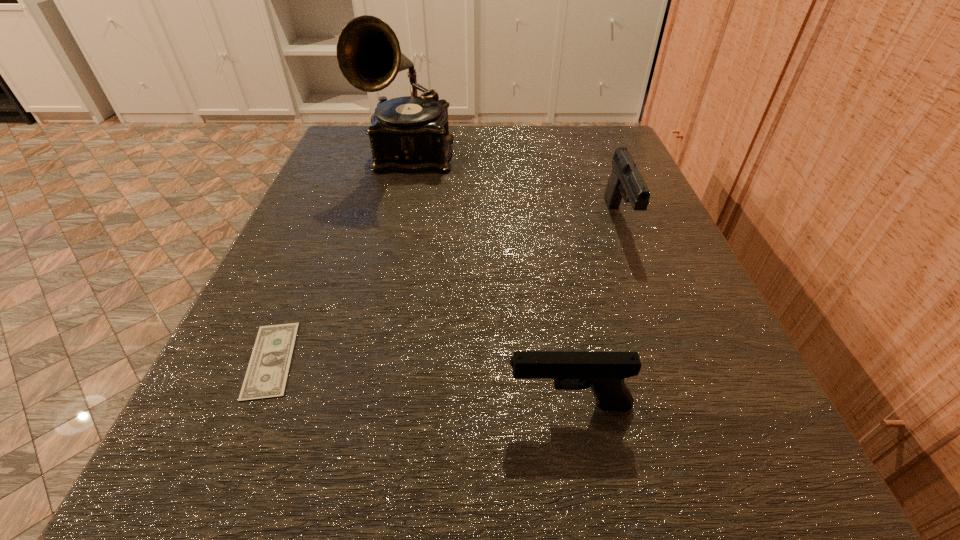
I want to click on phonograph record, so click(408, 134).

Locate an element on the screen. The image size is (960, 540). the tallest object is located at coordinates (408, 134).

The image size is (960, 540). Find the location of `the farther pistol`. the farther pistol is located at coordinates click(625, 180).

Identify the location of the rightmost object. (625, 180).

The height and width of the screenshot is (540, 960). What are the coordinates of `the nearer pistol` in the screenshot? It's located at (604, 372).

This screenshot has width=960, height=540. Find the location of `the third object from left to right`. the third object from left to right is located at coordinates (604, 372).

Locate an element on the screen. money is located at coordinates (266, 377).

The image size is (960, 540). I want to click on free location located on the horn of the farthest object, so click(377, 291).

You are a GUI agent. You are given a task and a screenshot of the screen. Output one action in this format:
    pyautogui.click(x=<x>, y=<y>)
    Task: Click on the vacant space located aim along the barrel of the right pistol
    
    Given the screenshot: What is the action you would take?
    pyautogui.click(x=661, y=330)

Identify the location of vacant space located on the front-facing side of the nearer pistol. (451, 405).